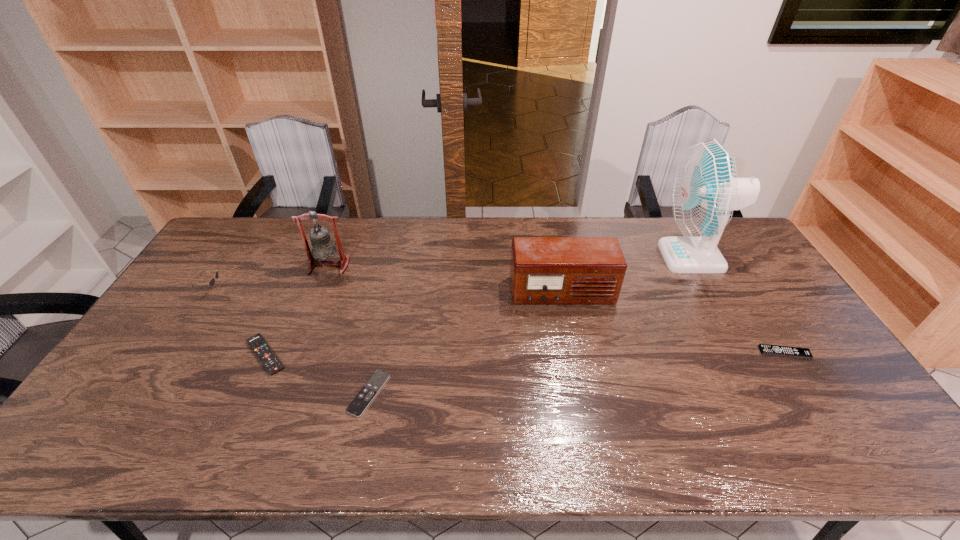
Find the location of a particular element. free region located in front of the fan to face the airflow is located at coordinates (596, 257).

Where is `free space located in front of the fan to face the airflow`? free space located in front of the fan to face the airflow is located at coordinates (576, 257).

This screenshot has height=540, width=960. What are the coordinates of `vacant position located in front of the fan to face the airflow` in the screenshot? It's located at (556, 257).

At what (x,y) coordinates should I click in order to perform the action: click on vacant position located on the front of the second tallest object. Please return your answer as a coordinate pair (x, y). The image size is (960, 540). Looking at the image, I should click on (313, 306).

You are a GUI agent. You are given a task and a screenshot of the screen. Output one action in this format:
    pyautogui.click(x=<x>, y=<y>)
    Task: Click on the vacant area located 0.300m on the front-facing side of the fifth shortest object
    The width and height of the screenshot is (960, 540).
    Given the screenshot: What is the action you would take?
    pyautogui.click(x=582, y=394)

Identify the location of free space located 0.110m in front of the lenses of the sunglasses. The width and height of the screenshot is (960, 540). (256, 290).

Where is `free space located 0.280m on the right of the leftmost remote control`? This screenshot has width=960, height=540. free space located 0.280m on the right of the leftmost remote control is located at coordinates point(392,355).

Find the location of a particular element. free spot located on the back of the rightmost remote control is located at coordinates (722, 256).

Where is `free space located 0.160m on the left of the second remote control from right to left`? free space located 0.160m on the left of the second remote control from right to left is located at coordinates (289, 393).

Where is `fan that is at the far edge`? Image resolution: width=960 pixels, height=540 pixels. fan that is at the far edge is located at coordinates (705, 191).